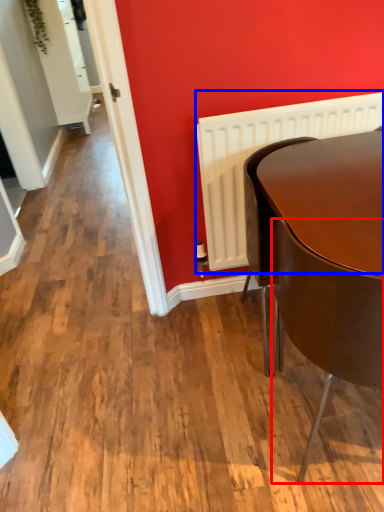
Question: Which object is closer to the camera taking this photo, chair (highlighted by a red box) or radiator (highlighted by a blue box)?

Choices:
 (A) chair
 (B) radiator

Answer: (A)